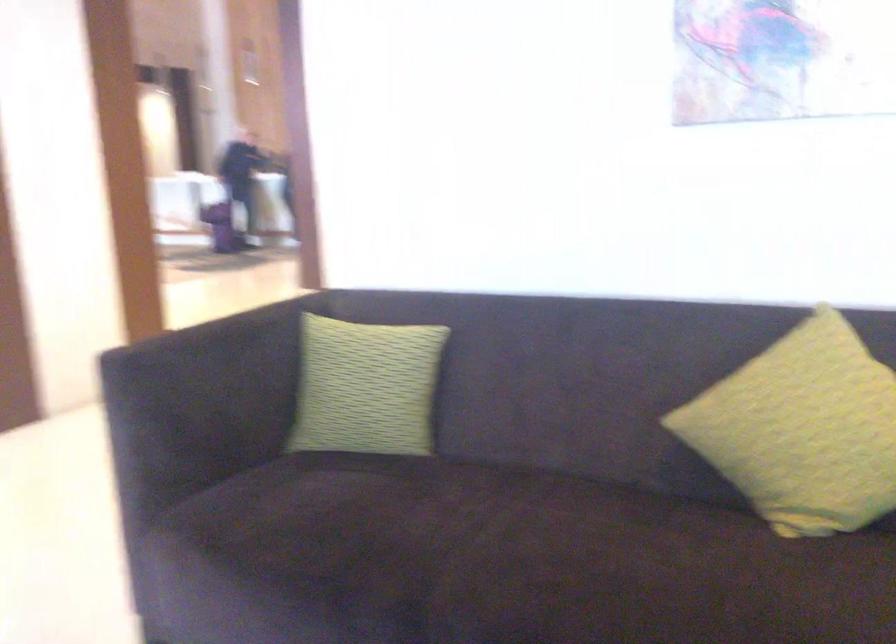
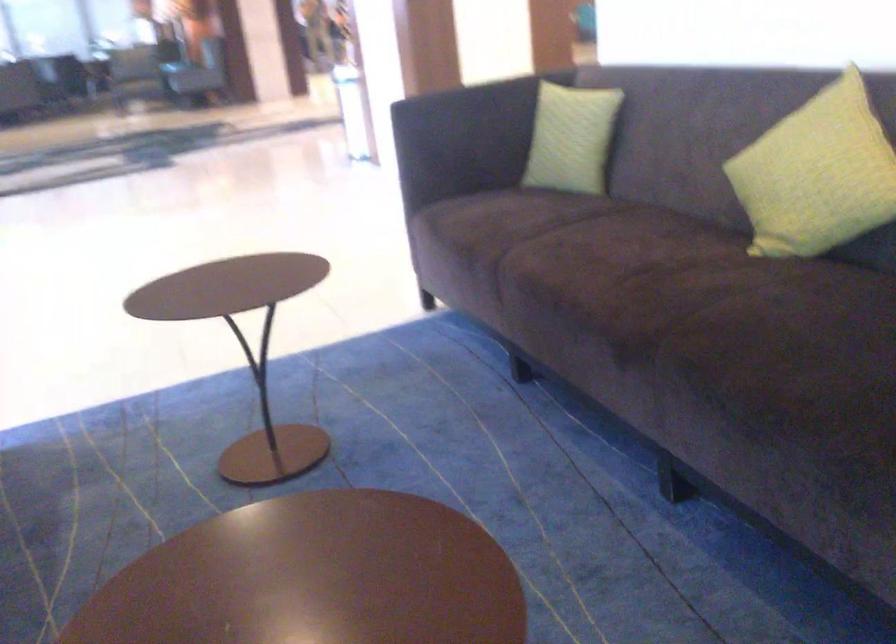
Where in the second image is the point corresponding to point (364, 522) from the first image?

(509, 221)